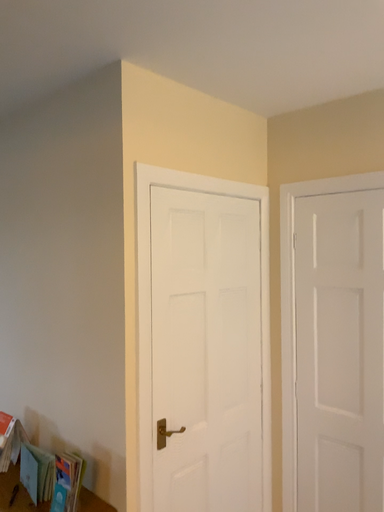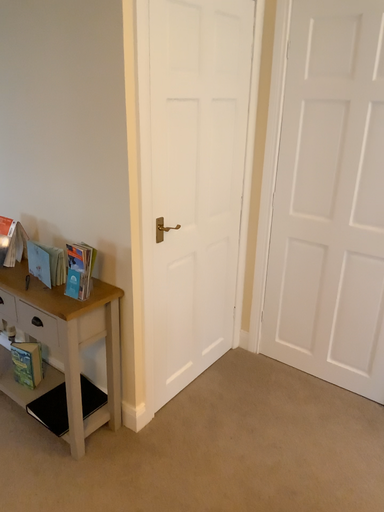
Question: Which way did the camera rotate in the video?

Choices:
 (A) rotated downward
 (B) rotated upward

Answer: (A)